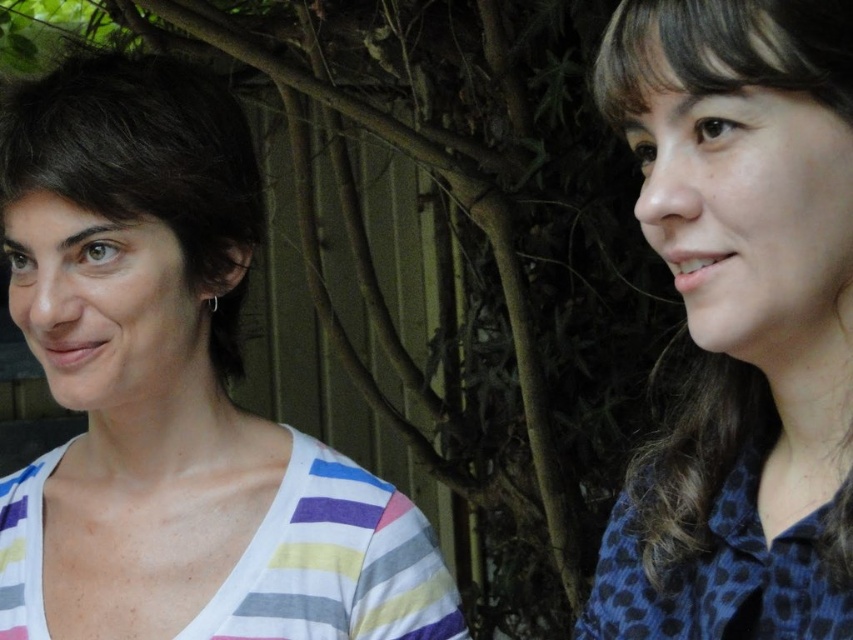
In the scene shown: Is white striped shirt at left smaller than dark brown hair at left?

No.

Is point (189, 152) farther from viewer compared to point (184, 99)?

No, (189, 152) is in front of (184, 99).

Is point (138, 104) less distant than point (175, 106)?

Yes, point (138, 104) is closer to viewer.

Where is `white striped shirt at left`? Image resolution: width=853 pixels, height=640 pixels. white striped shirt at left is located at coordinates (173, 392).

The height and width of the screenshot is (640, 853). What do you see at coordinates (173, 392) in the screenshot?
I see `white striped shirt at left` at bounding box center [173, 392].

The image size is (853, 640). I want to click on white striped shirt at left, so click(173, 392).

What do you see at coordinates (740, 321) in the screenshot? Image resolution: width=853 pixels, height=640 pixels. I see `blue dotted shirt at right` at bounding box center [740, 321].

Does blue dotted shirt at right appear over dark brown hair at left?

Incorrect, blue dotted shirt at right is not positioned above dark brown hair at left.

Between point (751, 205) and point (10, 177), which one is positioned behind?

The point (10, 177) is behind.

At what (x,y) coordinates should I click in order to perform the action: click on blue dotted shirt at right. Please return your answer as a coordinate pair (x, y). The image size is (853, 640). Looking at the image, I should click on (740, 321).